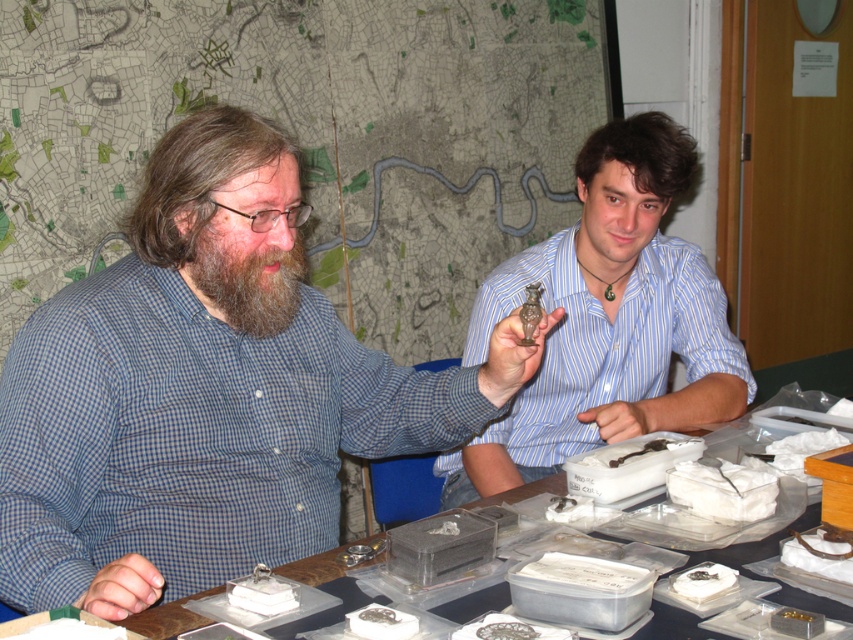
Is white matte food at lower center smaller than metallic silver coin at center?

No.

Image resolution: width=853 pixels, height=640 pixels. What do you see at coordinates (703, 580) in the screenshot?
I see `white matte food at lower center` at bounding box center [703, 580].

Does point (670, 573) lie behind point (415, 620)?

Yes, point (670, 573) is behind point (415, 620).

This screenshot has height=640, width=853. What are the coordinates of `white matte food at lower center` in the screenshot? It's located at (703, 580).

Who is taller, translucent plastic containers at center or brown matte food at center?

translucent plastic containers at center

Find the location of a particular element. translucent plastic containers at center is located at coordinates (398, 490).

Does white paper food at center have a greater height compared to metallic silver coin at center?

Indeed, white paper food at center has a greater height compared to metallic silver coin at center.

In order to click on white paper food at center in this screenshot , I will do `click(722, 490)`.

Image resolution: width=853 pixels, height=640 pixels. Find the location of `white paper food at center`. white paper food at center is located at coordinates (722, 490).

The image size is (853, 640). What are the coordinates of `white paper food at center` in the screenshot? It's located at (722, 490).